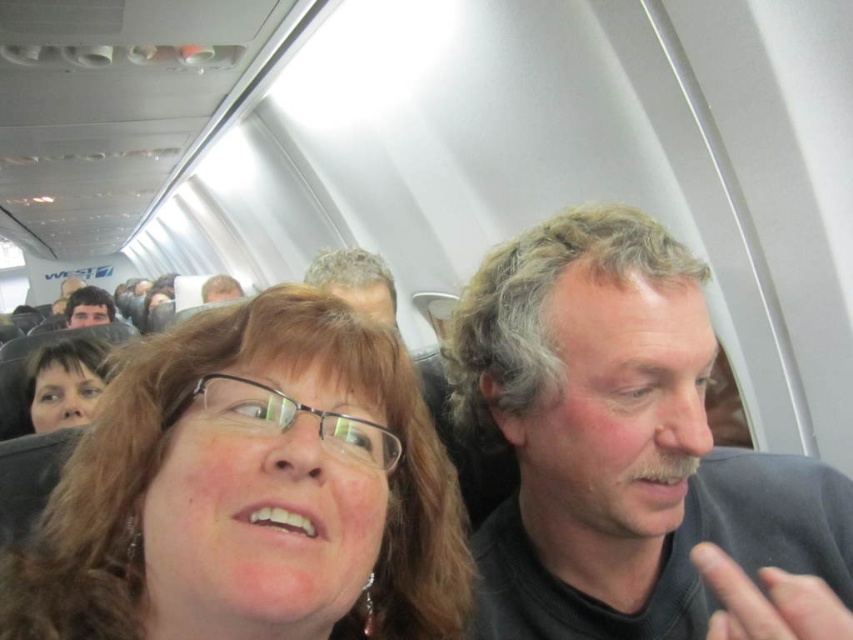
Question: Can you confirm if smooth skin face at center is positioned above smooth skin face at upper left?

Choices:
 (A) yes
 (B) no

Answer: (B)

Question: Which object appears farthest from the camera in this image?

Choices:
 (A) smooth skin face at center
 (B) gray hair man at center
 (C) gray hair at center
 (D) smooth skin face at upper left

Answer: (D)

Question: Which point is farther from the camera taking this photo?

Choices:
 (A) (357, 284)
 (B) (305, 618)

Answer: (A)

Question: Does matte black hair at center have a larger size compared to matte black glasses at center?

Choices:
 (A) no
 (B) yes

Answer: (B)

Question: Considering the relative positions of matte black glasses at center and gray hair man at center in the image provided, where is matte black glasses at center located with respect to gray hair man at center?

Choices:
 (A) right
 (B) left

Answer: (B)

Question: Which object appears closest to the camera in this image?

Choices:
 (A) matte black hair at center
 (B) smooth skin face at upper left
 (C) gray hair man at center

Answer: (A)